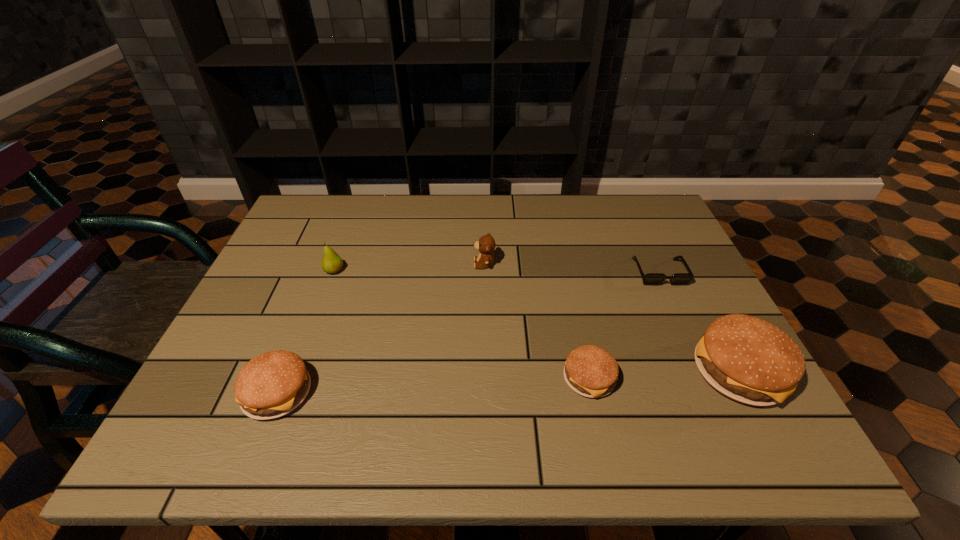
Image resolution: width=960 pixels, height=540 pixels. What are the coordinates of `free space between the shortest object and the pear` in the screenshot? It's located at (496, 272).

Find the location of `free area in between the leftmost hamburger and the tallest hamburger`. free area in between the leftmost hamburger and the tallest hamburger is located at coordinates (508, 382).

Where is `free area in between the fourth object from right to left and the pear`? This screenshot has width=960, height=540. free area in between the fourth object from right to left and the pear is located at coordinates (409, 267).

You are a GUI agent. You are given a task and a screenshot of the screen. Output one action in this format:
    pyautogui.click(x=<x>, y=<y>)
    Task: Click on the vacant space in between the second hamburger from right to left and the rightmost hamburger
    Image resolution: width=960 pixels, height=540 pixels.
    Given the screenshot: What is the action you would take?
    [664, 375]

Image resolution: width=960 pixels, height=540 pixels. Find the location of `free point between the fourth object from right to left and the pear`. free point between the fourth object from right to left and the pear is located at coordinates (409, 267).

The width and height of the screenshot is (960, 540). I want to click on free space between the shortest object and the tallest hamburger, so click(699, 322).

This screenshot has height=540, width=960. Identify the location of unoccupied position between the leftmost hamburger and the shortest object. (468, 333).

Where is `the third closest object to the teddy bear`? Image resolution: width=960 pixels, height=540 pixels. the third closest object to the teddy bear is located at coordinates (651, 278).

Select which object appears as the fifth closest to the leftmost hamburger. Please provide its 2D coordinates. Your answer should be formatted as a tuple, i.e. [(x, y)], where the tuple contains the x and y coordinates of a point satisfying the conditions above.

[(747, 359)]

The height and width of the screenshot is (540, 960). Identify the location of hamburger that can be found as the third closest to the sunglasses. (272, 384).